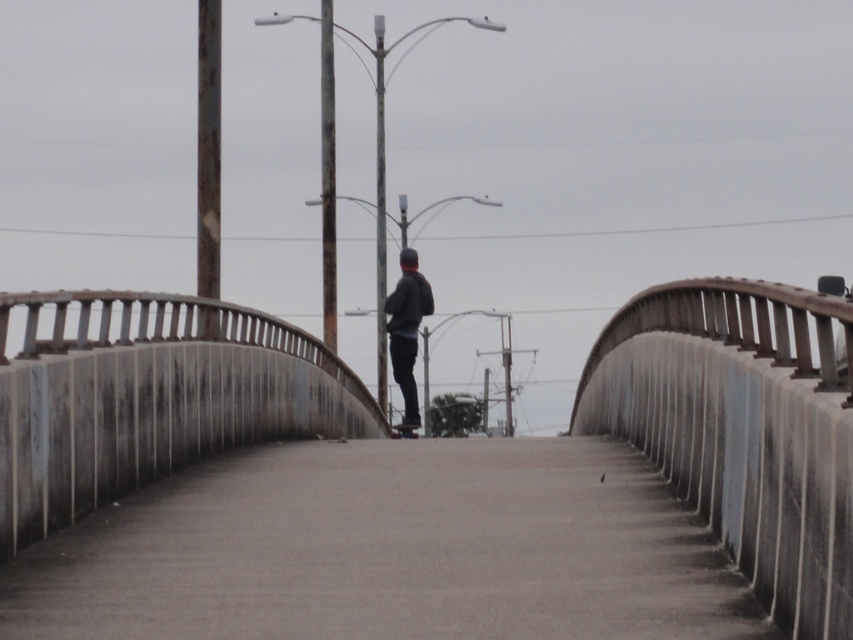
You are a skateboarder trying to find space to practice tricks on the smooth concrete path at center. You also notice the dark gray sweater at center. Which object takes up more area in the scene?

The dark gray sweater at center occupies more space than the smooth concrete path at center, so the sweater takes up more area in the scene.

You are standing on the bridge and want to place your backpack on the railing. Can you confirm the exact location of the smooth concrete railing at center?

The smooth concrete railing at center is located at point (741, 429).

You are standing at point A located at coordinates point A at (x=728, y=552). There is a skateboarder at point B. The distance between point A and the skateboarder is 9.60 meters. If you walk directly towards the skateboarder, will you reach them before the bridge ends? The bridge is 12 meters long.

The distance between point A and the skateboarder is 9.60 meters, and the bridge is 12 meters long. Since 9.60 meters is less than 12 meters, you will reach the skateboarder before the bridge ends.